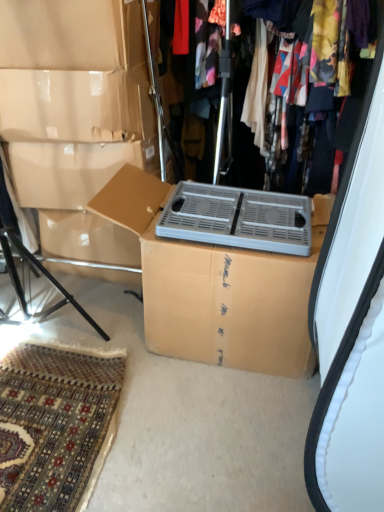
You are a GUI agent. You are given a task and a screenshot of the screen. Output one action in this format:
    pyautogui.click(x=<x>, y=<y>)
    Task: Click on the free spot in front of cardboard box at center
    
    Given the screenshot: What is the action you would take?
    pyautogui.click(x=158, y=413)